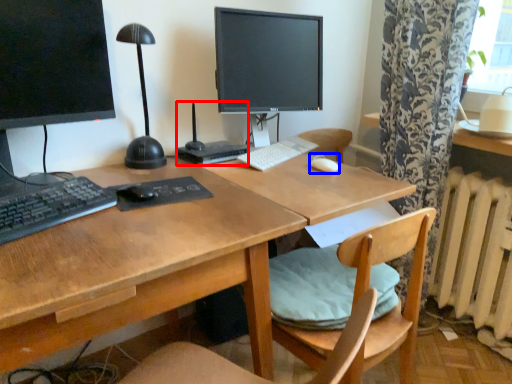
Question: Which point is further to the camera, computer (highlighted by a red box) or mouse (highlighted by a blue box)?

Choices:
 (A) computer
 (B) mouse

Answer: (B)